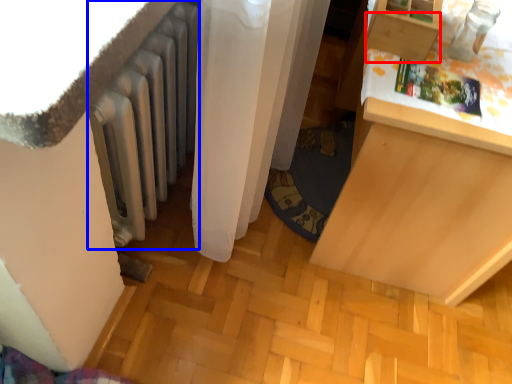
Question: Which object appears closest to the camera in this image, drawer (highlighted by a red box) or radiator (highlighted by a blue box)?

Choices:
 (A) drawer
 (B) radiator

Answer: (B)